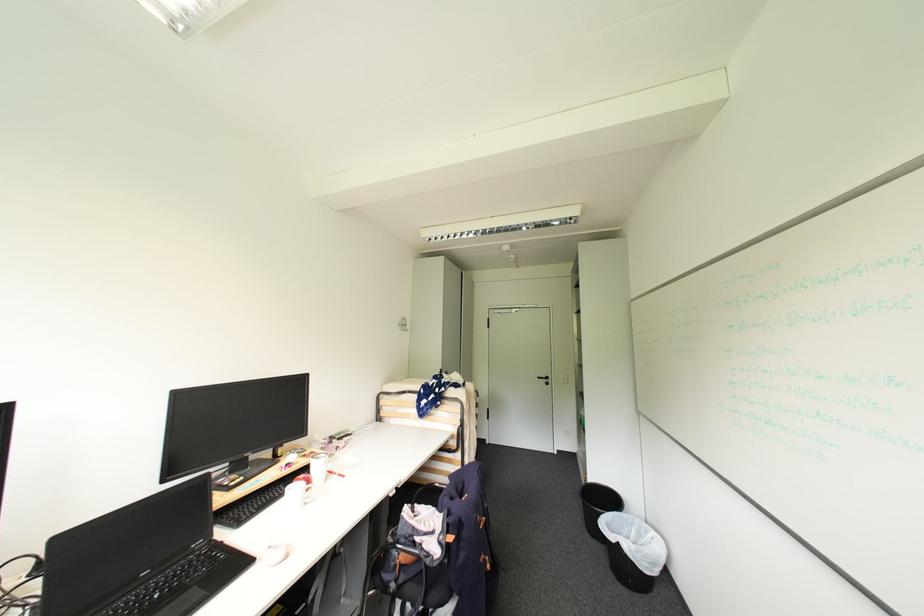
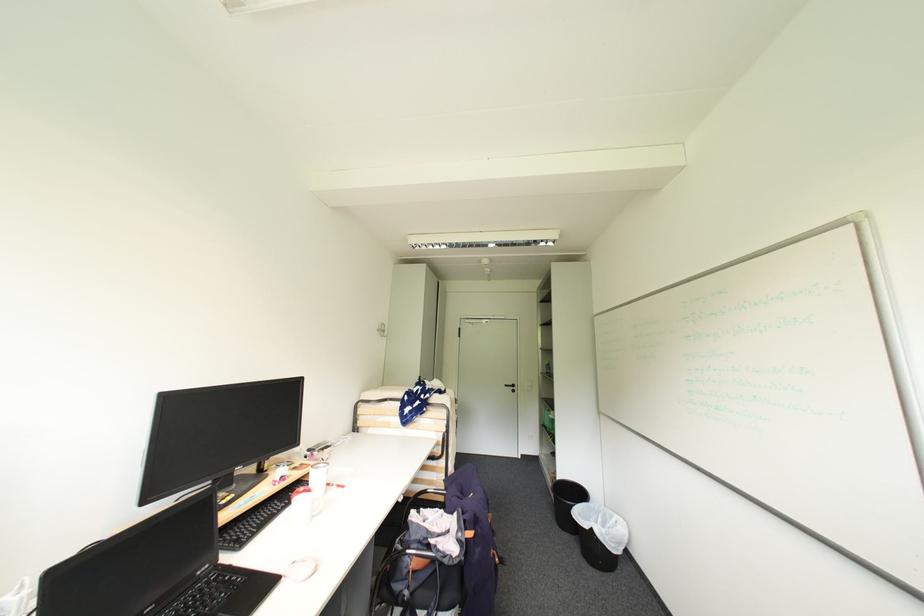
The point at (420,545) is marked in the first image. Where is the corresponding point in the second image?

(435, 548)